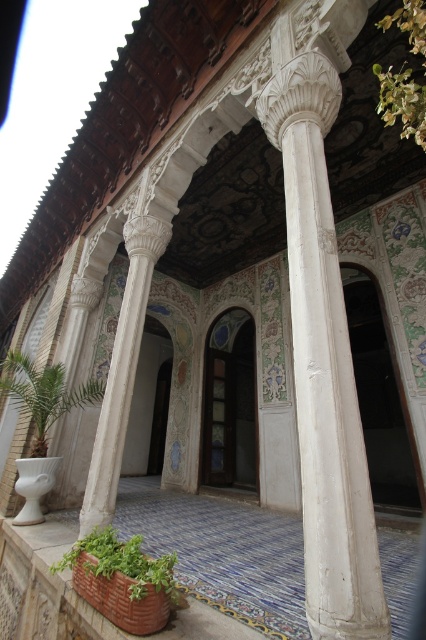
Can you confirm if green leafy plant in terracotta pot at lower left is thinner than green leafy plant at lower left?

Yes.

At what (x,y) coordinates should I click in order to perform the action: click on green leafy plant in terracotta pot at lower left. Please return your answer as a coordinate pair (x, y). The height and width of the screenshot is (640, 426). Looking at the image, I should click on (123, 563).

The width and height of the screenshot is (426, 640). What are the coordinates of `green leafy plant in terracotta pot at lower left` in the screenshot? It's located at (123, 563).

Can you confirm if terracotta clay pot at lower center is bigger than green leafy plant in terracotta pot at lower left?

Correct, terracotta clay pot at lower center is larger in size than green leafy plant in terracotta pot at lower left.

Consider the image. Is terracotta clay pot at lower center smaller than green leafy plant in terracotta pot at lower left?

Actually, terracotta clay pot at lower center might be larger than green leafy plant in terracotta pot at lower left.

This screenshot has width=426, height=640. Find the location of `terracotta clay pot at lower center`. terracotta clay pot at lower center is located at coordinates (77, 595).

Identify the location of terracotta clay pot at lower center. (77, 595).

Which is behind, point (310, 237) or point (77, 566)?

The point (77, 566) is more distant.

Is white marble column at center in front of green leafy plant in terracotta pot at lower left?

Yes, white marble column at center is closer to the viewer.

The width and height of the screenshot is (426, 640). Describe the element at coordinates (322, 324) in the screenshot. I see `white marble column at center` at that location.

Where is `white marble column at center`? white marble column at center is located at coordinates (322, 324).